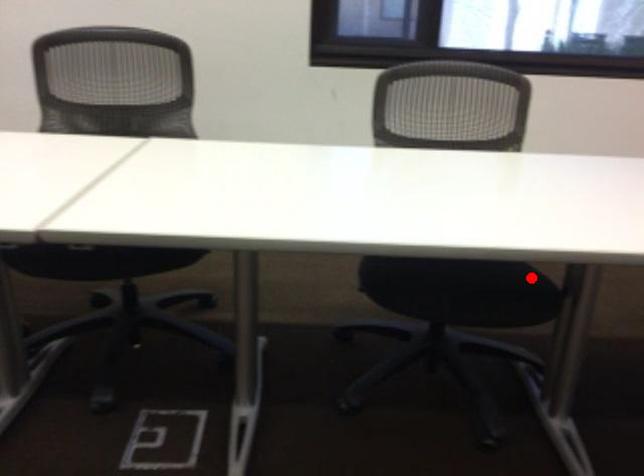
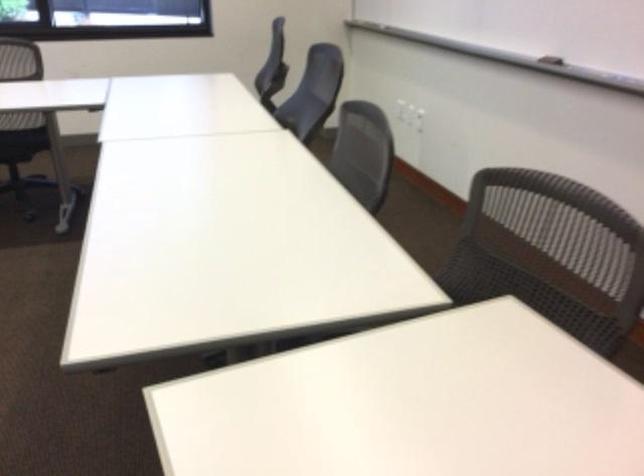
Find the pixel in the second image that matches the highlighted location in the first image.

(22, 143)